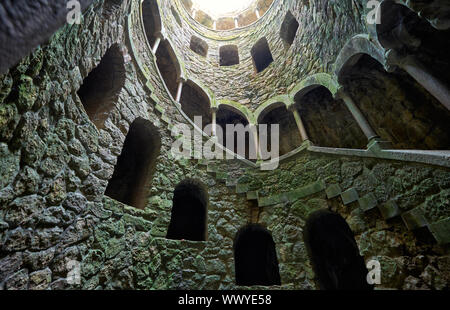
Where is `staircase`? This screenshot has height=310, width=450. staircase is located at coordinates (423, 154).